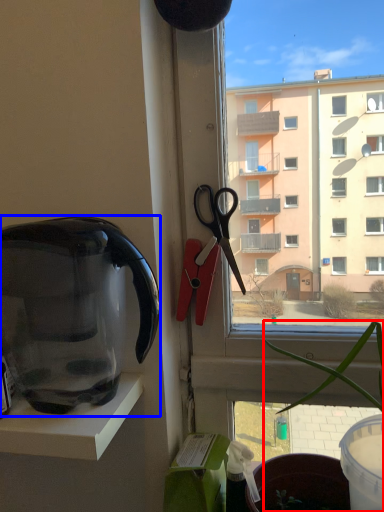
Question: Among these objects, which one is farthest to the camera, houseplant (highlighted by a red box) or kettle (highlighted by a blue box)?

Choices:
 (A) houseplant
 (B) kettle

Answer: (B)